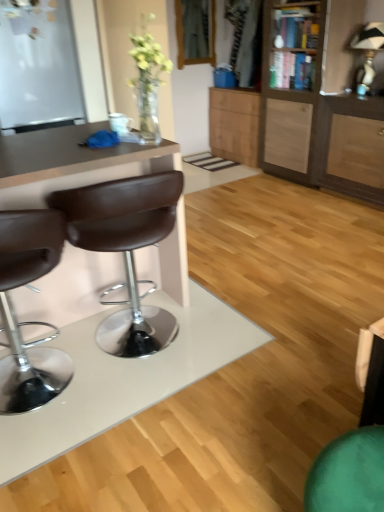
Identify the location of vacant space underneath brown leather stool at left, arranged as the 1th chair when viewed from the right (from a real-world perspective). (146, 347).